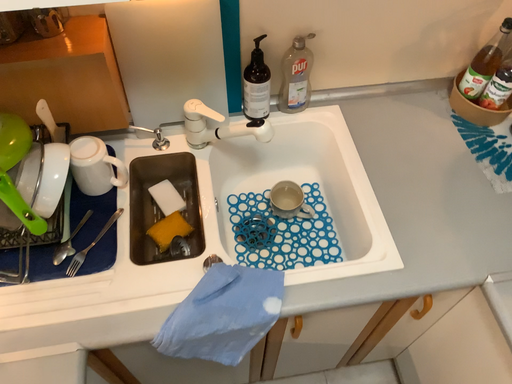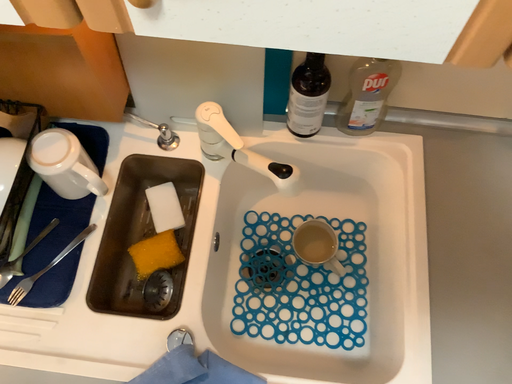
Question: How did the camera likely rotate when shooting the video?

Choices:
 (A) rotated downward
 (B) rotated upward

Answer: (A)